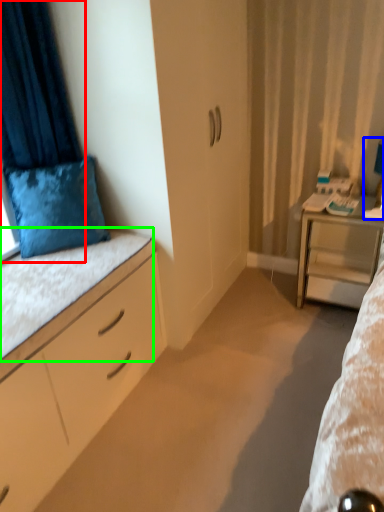
Question: Which object is the closest to the curtain (highlighted by a red box)? Choose among these: table lamp (highlighted by a blue box) or ledge (highlighted by a green box).

Choices:
 (A) table lamp
 (B) ledge

Answer: (B)